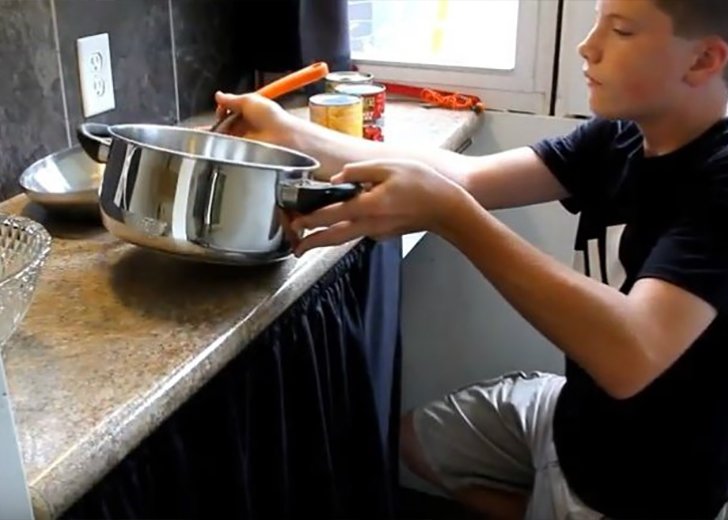
Locate an element on the screen. The image size is (728, 520). white wall socket is located at coordinates (103, 77).